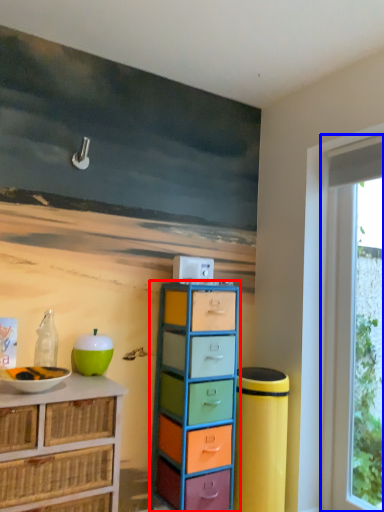
Question: Which object appears closest to the camera in this image, chest of drawers (highlighted by a red box) or window (highlighted by a blue box)?

Choices:
 (A) chest of drawers
 (B) window

Answer: (A)